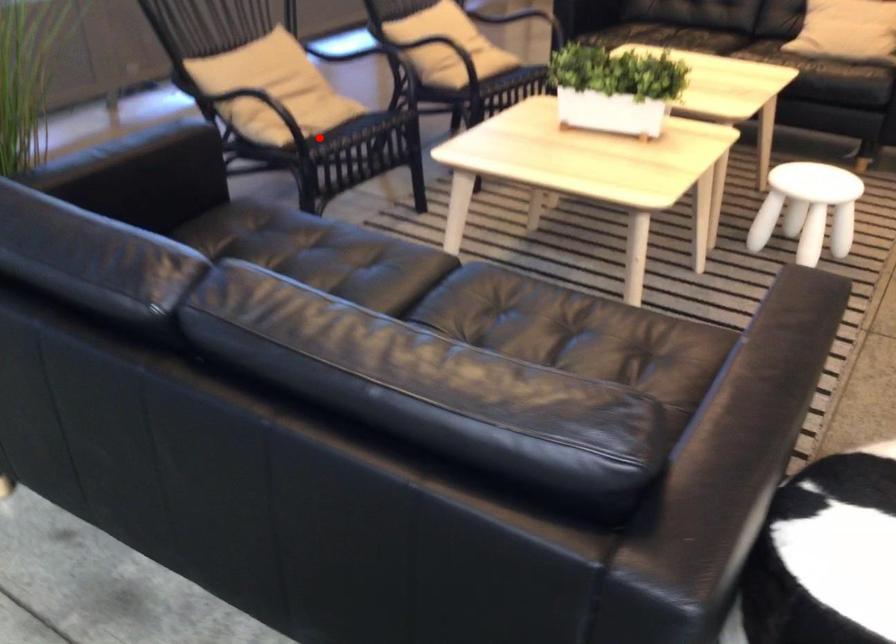
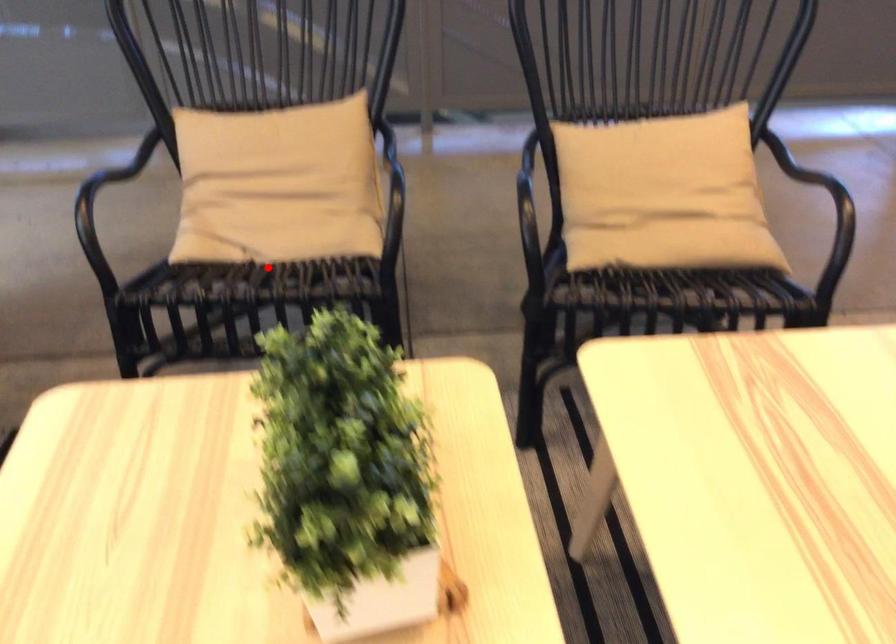
I am providing you with two images of the same scene from different viewpoints. A red point is marked on the first image and another point is marked on the second image. Are the points marked in image1 and image2 representing the same 3D position?

Yes